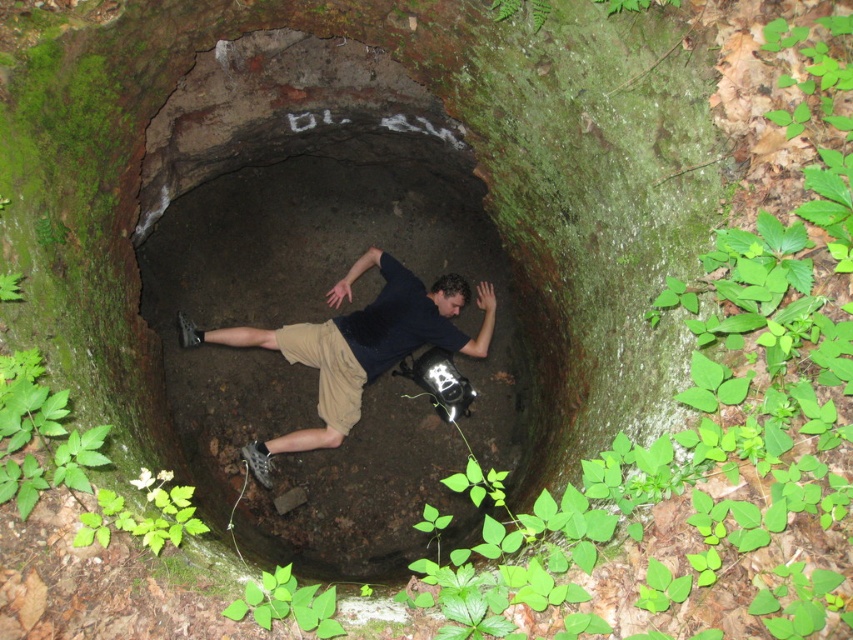
Question: Is black matte shirt at center smaller than khaki cotton shorts at center?

Choices:
 (A) yes
 (B) no

Answer: (B)

Question: Is brown dirt cave at center closer to the viewer compared to khaki cotton shorts at center?

Choices:
 (A) no
 (B) yes

Answer: (B)

Question: Which of the following is the farthest from the observer?

Choices:
 (A) black matte shirt at center
 (B) khaki cotton shorts at center
 (C) brown dirt cave at center

Answer: (A)

Question: Which point appears closest to the camera in this image?

Choices:
 (A) (334, 326)
 (B) (189, 205)
 (C) (326, 328)

Answer: (C)

Question: Is brown dirt cave at center closer to the viewer compared to khaki cotton shorts at center?

Choices:
 (A) yes
 (B) no

Answer: (A)

Question: Which point is closer to the camera?

Choices:
 (A) black matte shirt at center
 (B) khaki cotton shorts at center
 (C) brown dirt cave at center

Answer: (C)